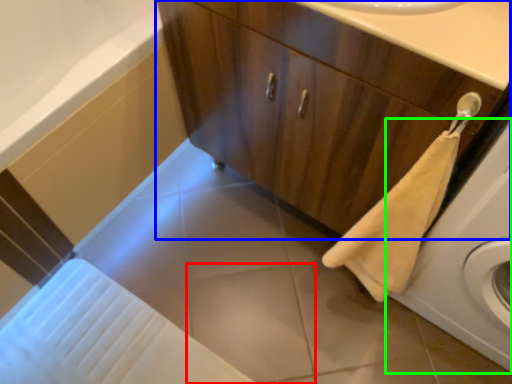
Question: Which object is the closest to the tile (highlighted by a red box)? Choose among these: bathroom cabinet (highlighted by a blue box) or washing machine (highlighted by a green box).

Choices:
 (A) bathroom cabinet
 (B) washing machine

Answer: (B)